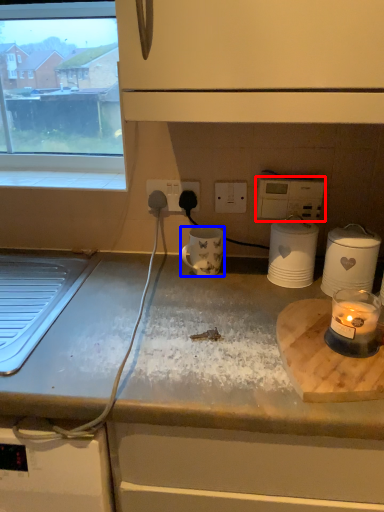
Question: Which point is closer to the camera, appliance (highlighted by a red box) or mug (highlighted by a blue box)?

Choices:
 (A) appliance
 (B) mug

Answer: (B)